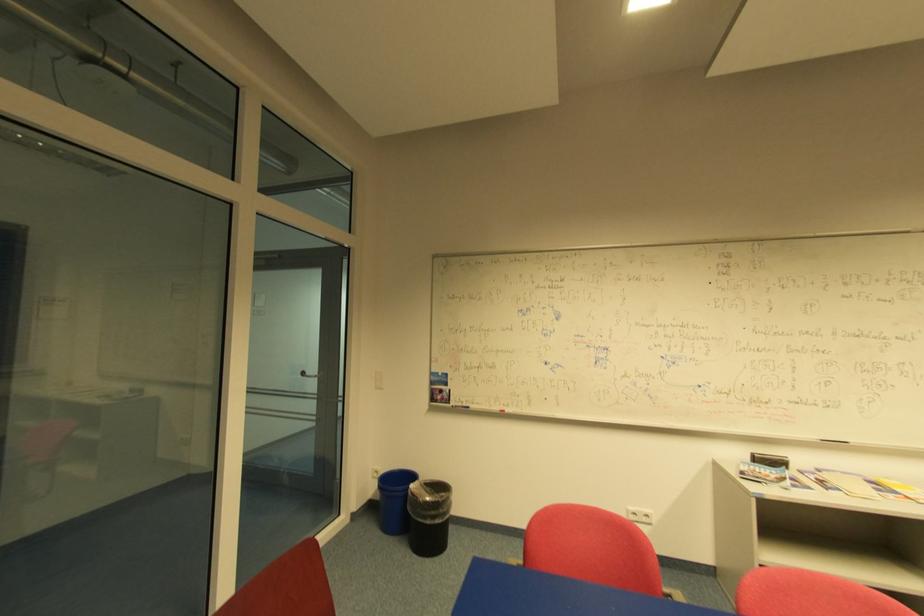
Find where to pull the silver door handle. Please return your answer as a coordinate pair (x, y).

(309, 374)